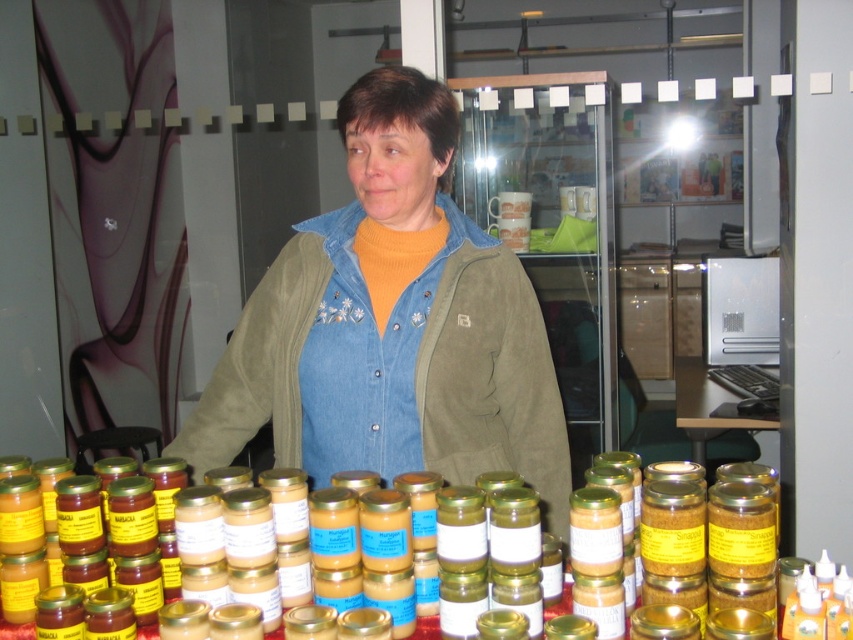
Measure the distance from denim jacket at center to clear plastic table at center.

A distance of 1.68 meters exists between denim jacket at center and clear plastic table at center.

Based on the photo, does denim jacket at center come in front of clear plastic table at center?

Yes.

The width and height of the screenshot is (853, 640). Identify the location of denim jacket at center. (392, 324).